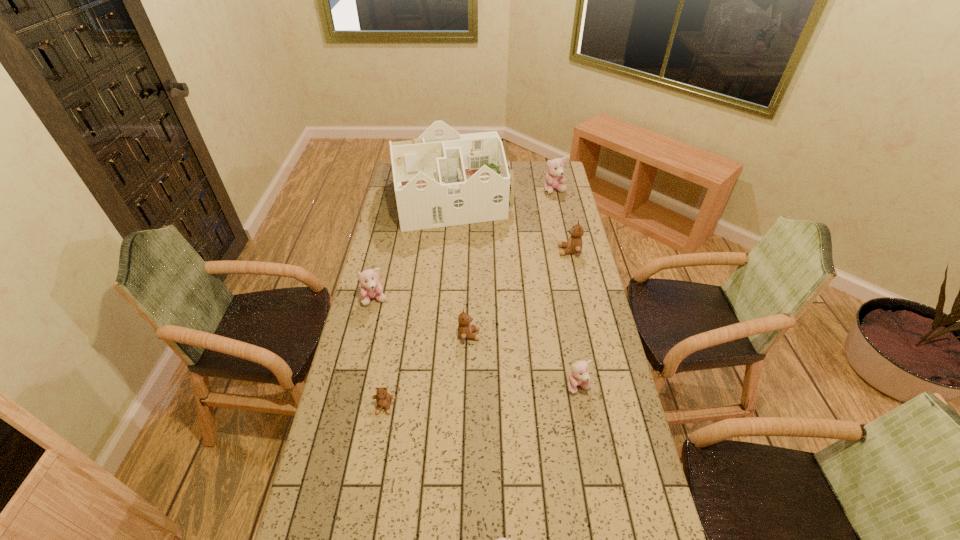
Select which brown teddy bear appears as the closest to the third nearest object. Please provide its 2D coordinates. Your answer should be formatted as a tuple, i.e. [(x, y)], where the tuple contains the x and y coordinates of a point satisfying the conditions above.

[(465, 330)]

Locate an element on the screen. free space in the image that satisfies the following two spatial constraints: 1. on the front-facing side of the second farthest brown teddy bear; 2. on the front-facing side of the sixth teddy bear from right to left is located at coordinates (468, 407).

Locate an element on the screen. The height and width of the screenshot is (540, 960). vacant space that satisfies the following two spatial constraints: 1. on the front-facing side of the farthest brown teddy bear; 2. on the front-facing side of the seventh farthest object is located at coordinates (604, 407).